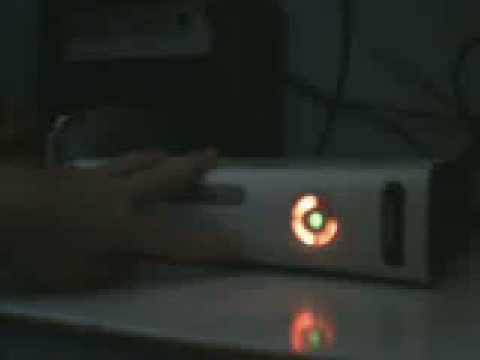
Locate an element on the screen. wall is located at coordinates (369, 76).